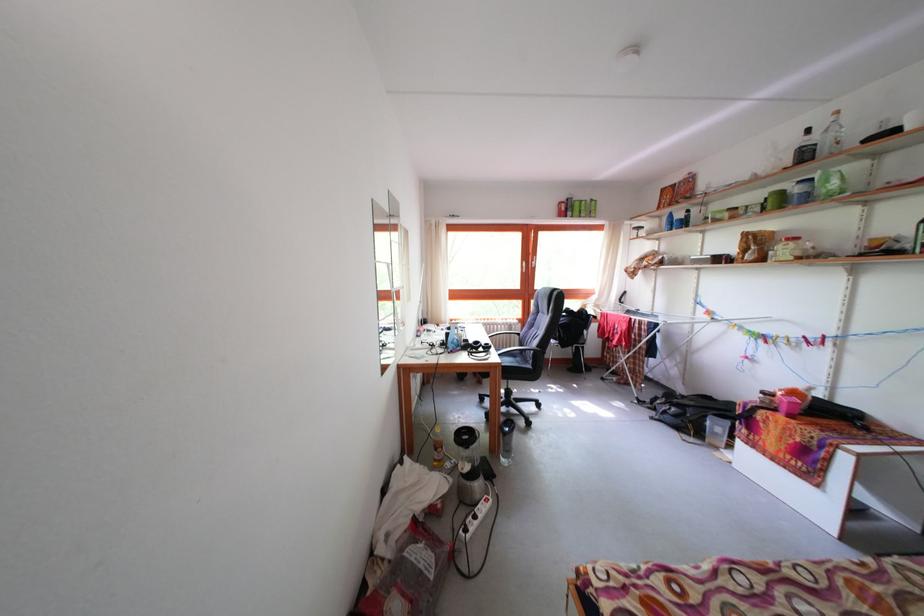
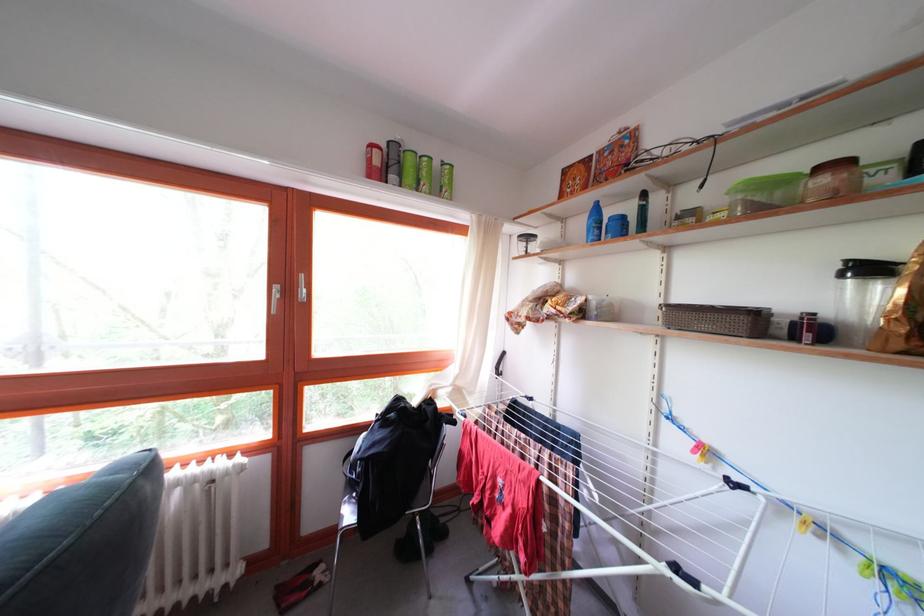
In the second image, find the point that corresponds to the point at 589,219 in the first image.

(428, 187)